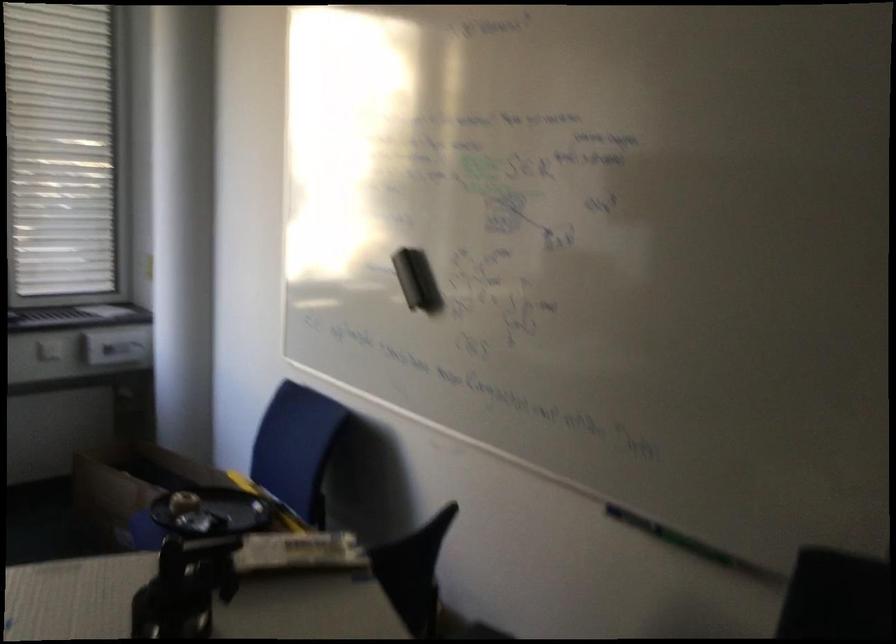
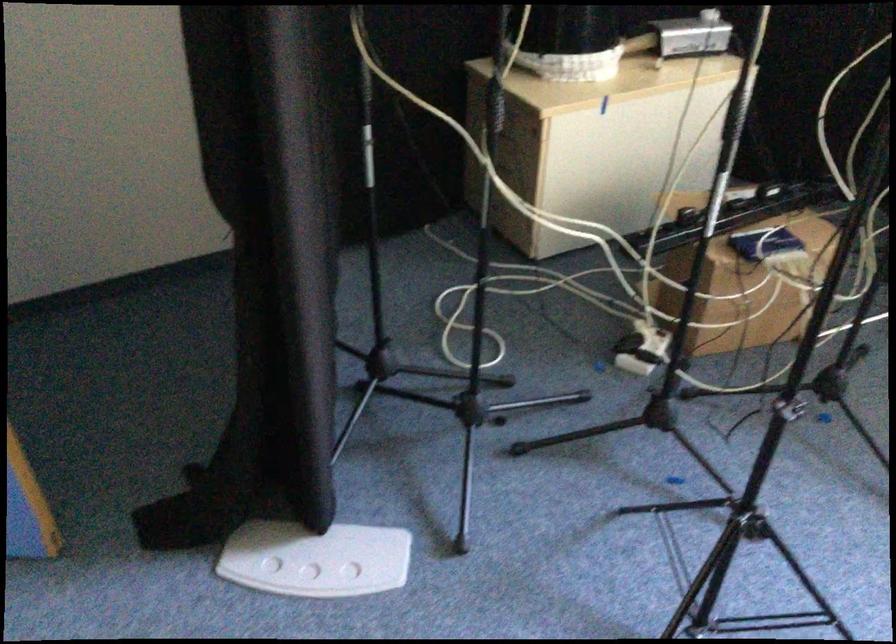
From the picture: Based on the continuous images, in which direction is the camera rotating?

The rotation direction of the camera is left-down.